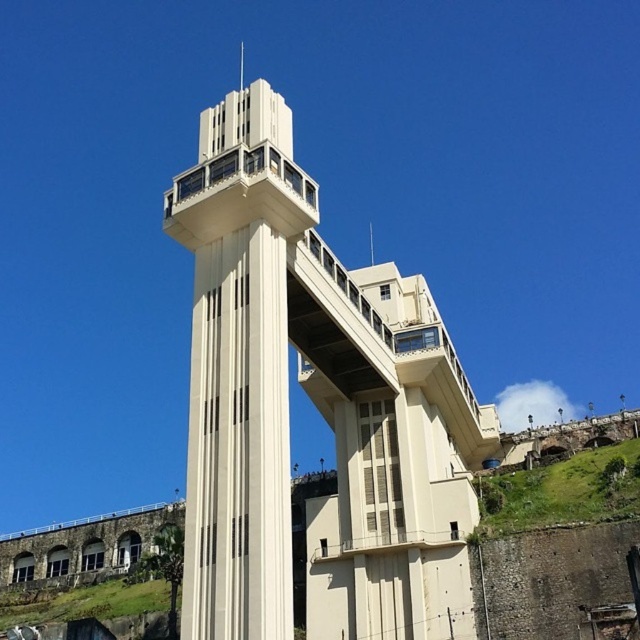
Question: Can you confirm if beige concrete tower at center is positioned to the left of white smooth tower at center?

Choices:
 (A) yes
 (B) no

Answer: (B)

Question: Does beige concrete tower at center have a larger size compared to white smooth tower at center?

Choices:
 (A) yes
 (B) no

Answer: (A)

Question: Which of the following is the farthest from the observer?

Choices:
 (A) beige concrete tower at center
 (B) white smooth tower at center

Answer: (A)

Question: Is beige concrete tower at center below white smooth tower at center?

Choices:
 (A) yes
 (B) no

Answer: (B)

Question: Among these points, which one is nearest to the camera?

Choices:
 (A) (200, 369)
 (B) (259, 592)

Answer: (B)